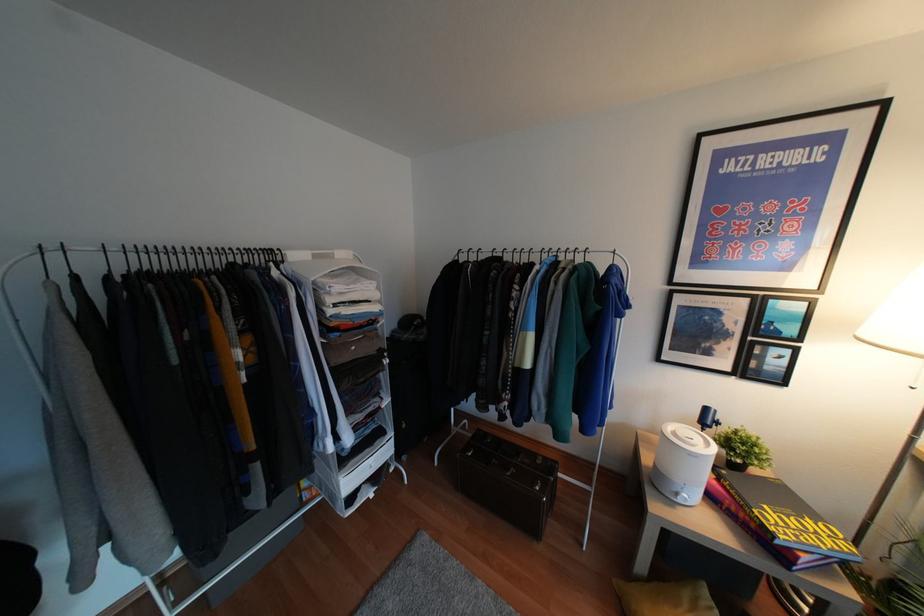
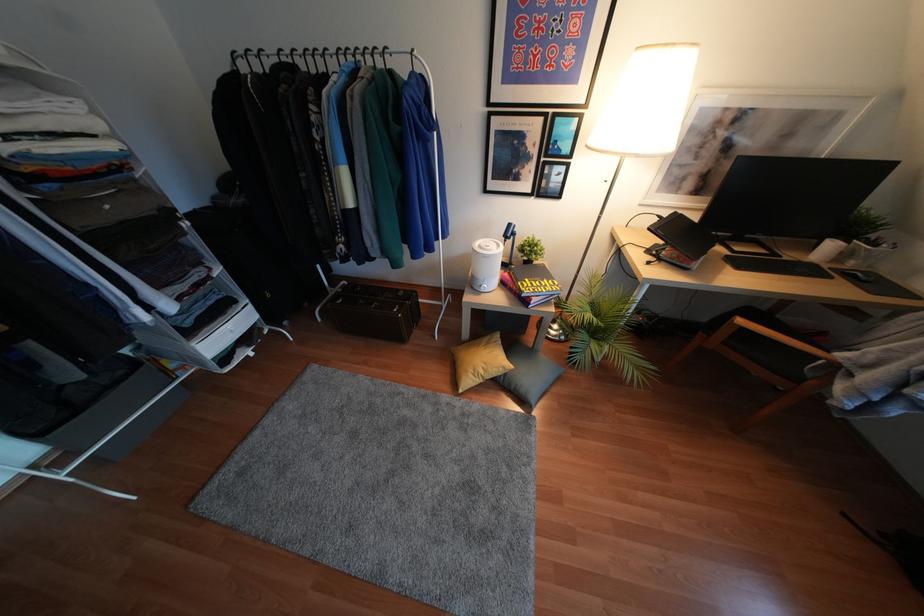
In the second image, find the point that corresponds to point (678, 500) in the first image.

(481, 290)